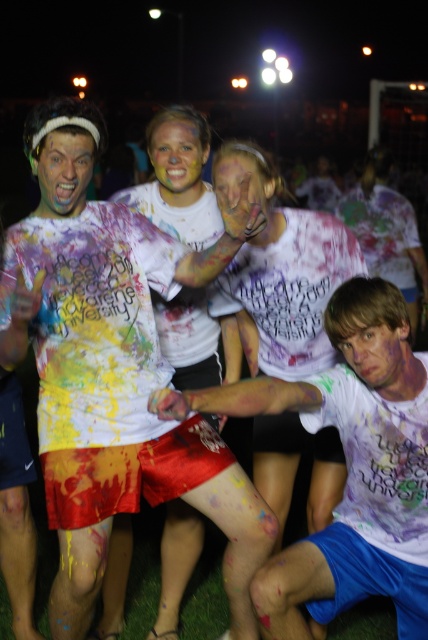
Question: Does matte white t-shirt at center appear over white t-shirt at lower right?

Choices:
 (A) no
 (B) yes

Answer: (A)

Question: Which object is positioned closest to the matte white t-shirt at center?

Choices:
 (A) white t-shirt at lower right
 (B) painted skin face at center
 (C) shiny plastic face at center

Answer: (B)

Question: Which point appears farthest from the camera in this image?

Choices:
 (A) (47, 445)
 (B) (404, 384)
 (C) (89, 147)

Answer: (A)

Question: Which object is positioned closest to the matte white t-shirt at center?

Choices:
 (A) white t-shirt at center
 (B) white t-shirt at lower right

Answer: (A)

Question: Is white t-shirt at lower right smaller than yellow matte face paint at center?

Choices:
 (A) yes
 (B) no

Answer: (B)

Question: Is yellow matte face paint at center behind painted skin face at center?

Choices:
 (A) no
 (B) yes

Answer: (B)